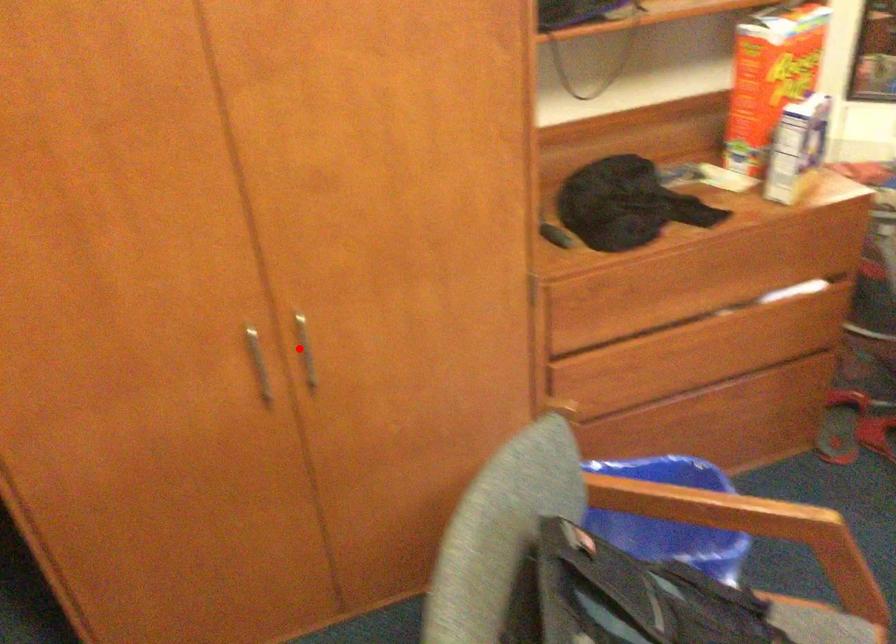
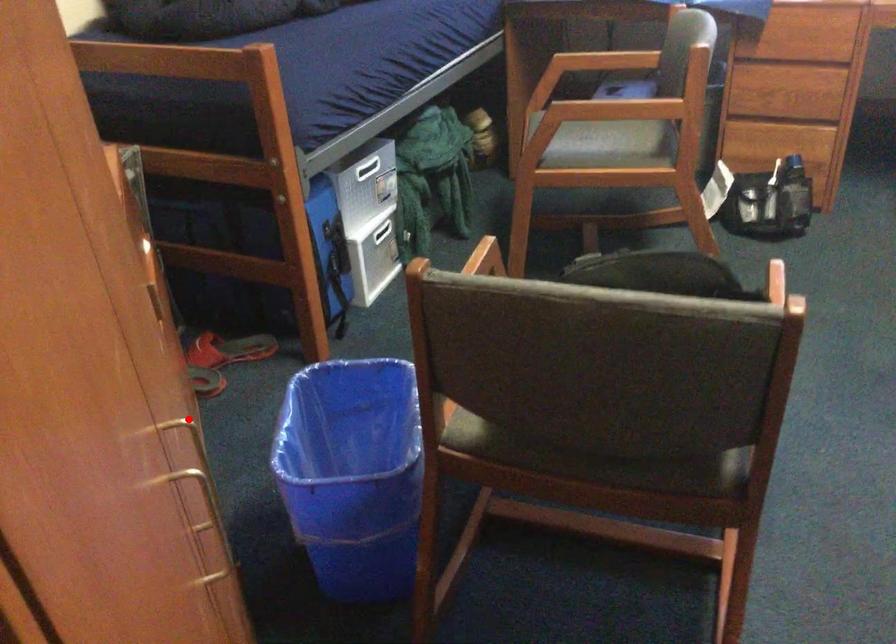
I am providing you with two images of the same scene from different viewpoints. A red point is marked on the first image and another point is marked on the second image. Is the red point in image1 aligned with the point shown in image2?

Yes